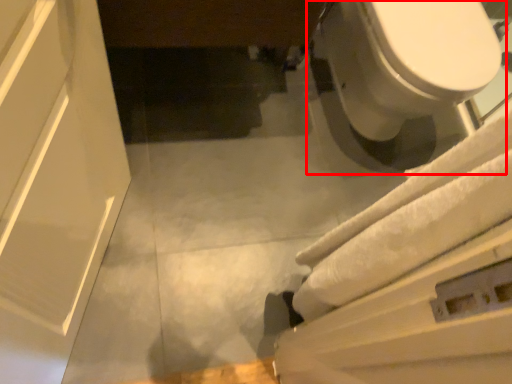
Question: From the image's perspective, where is toilet (annotated by the red box) located relative to bath towel?

Choices:
 (A) above
 (B) below

Answer: (A)